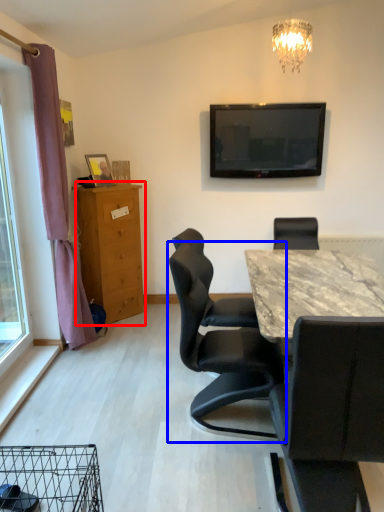
Question: Which point is closer to the camera, chest of drawers (highlighted by a red box) or chair (highlighted by a blue box)?

Choices:
 (A) chest of drawers
 (B) chair

Answer: (B)